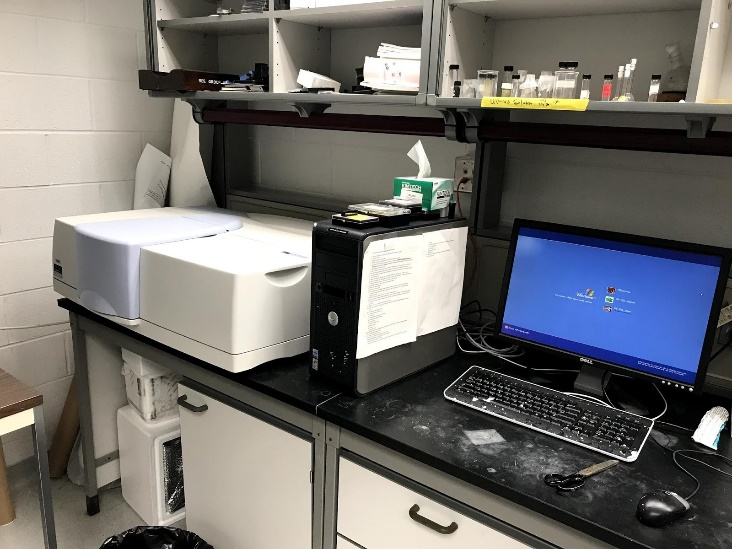
What are the coordinates of `bottle` in the screenshot? It's located at (452, 72), (459, 84), (507, 72), (512, 85), (564, 60), (586, 91), (605, 84), (653, 93).